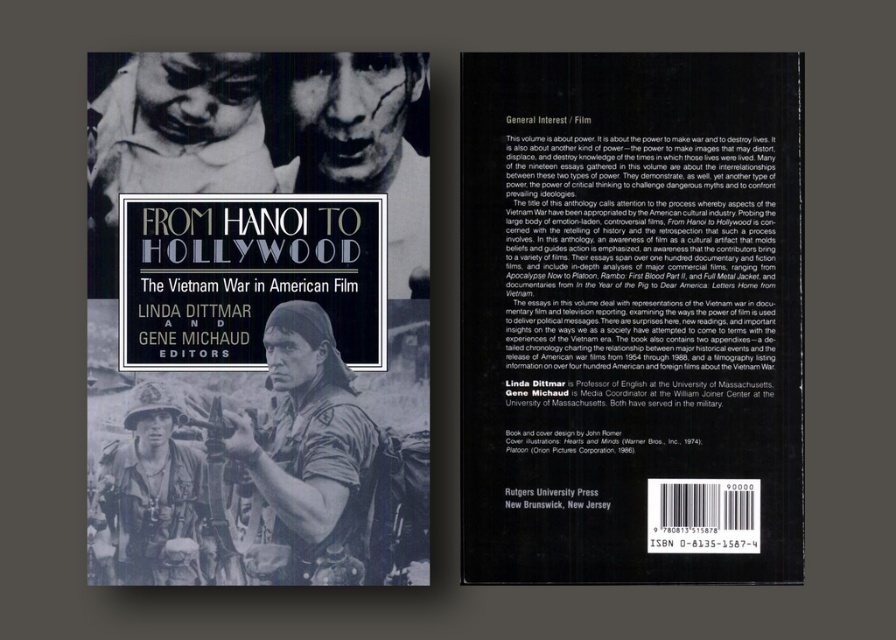
You are designing a display for a library and have placed a black matte book cover at upper center and a black matte face at upper center. The display requires that the distance between them is exactly 3 inches. Based on the image, will you need to adjust their positions?

The black matte book cover at upper center is 4.08 inches from the black matte face at upper center, which exceeds the required 3 inches. You will need to move them closer together to meet the display requirement.

You are standing in a library and see the black matte book cover at upper center on a shelf. If you want to reach it, will you need a ladder? The average bookshelf in the library is 1.8 meters tall.

The black matte book cover at upper center is 1.32 meters from the viewer, which is below the average bookshelf height of 1.8 meters. Therefore, you can reach it without needing a ladder.

You are a photographer analyzing the book cover. You notice two points marked on the cover at coordinates point (268, 564) and point (118, 442). Which point is closer to the camera?

Point (118, 442) is closer to the camera than point (268, 564) because the description states that point (268, 564) is further away.